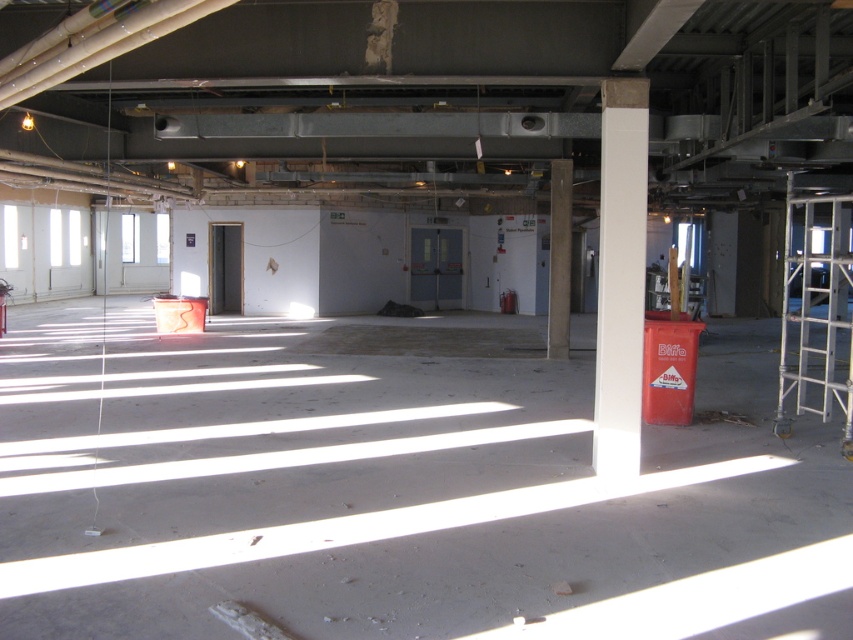
You are an architect inspecting the construction site. You notice the white smooth column at right and the white marble pillar at center. Which one is located to the left of the other?

The white smooth column at right is positioned on the left side of the white marble pillar at center, so it is to the left of the white marble pillar at center.

You are standing in the room and want to move towards the doors at the far end. Which object, the white smooth column at right or the white marble pillar at center, will you pass by first?

You will pass by the white marble pillar at center first because the white smooth column at right is closer to the viewer, meaning the pillar is further away and thus encountered later on the path to the doors.